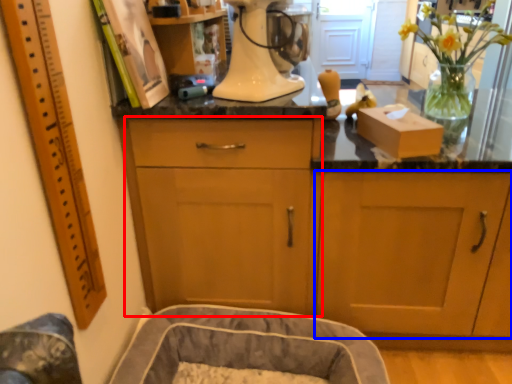
Question: Which object is further to the camera taking this photo, cabinetry (highlighted by a red box) or cabinetry (highlighted by a blue box)?

Choices:
 (A) cabinetry
 (B) cabinetry

Answer: (B)